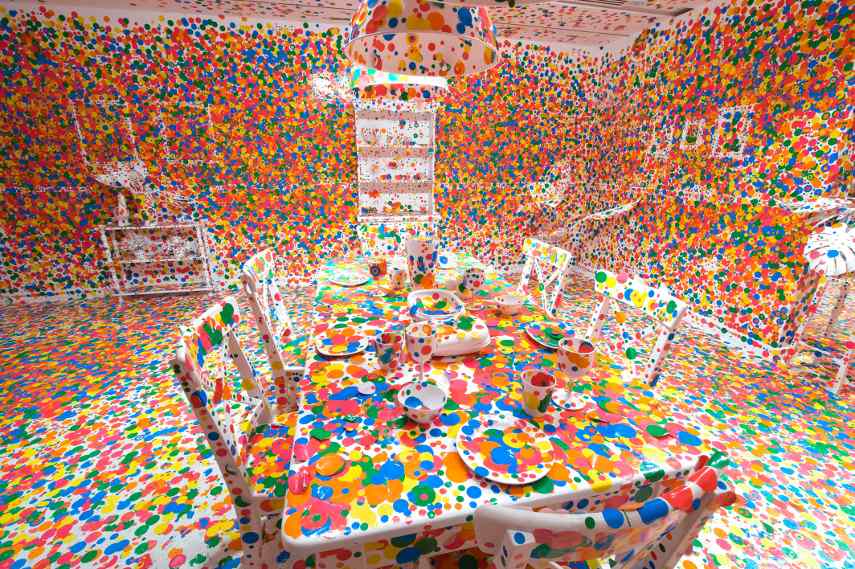
Identify the location of chair. (557, 279).